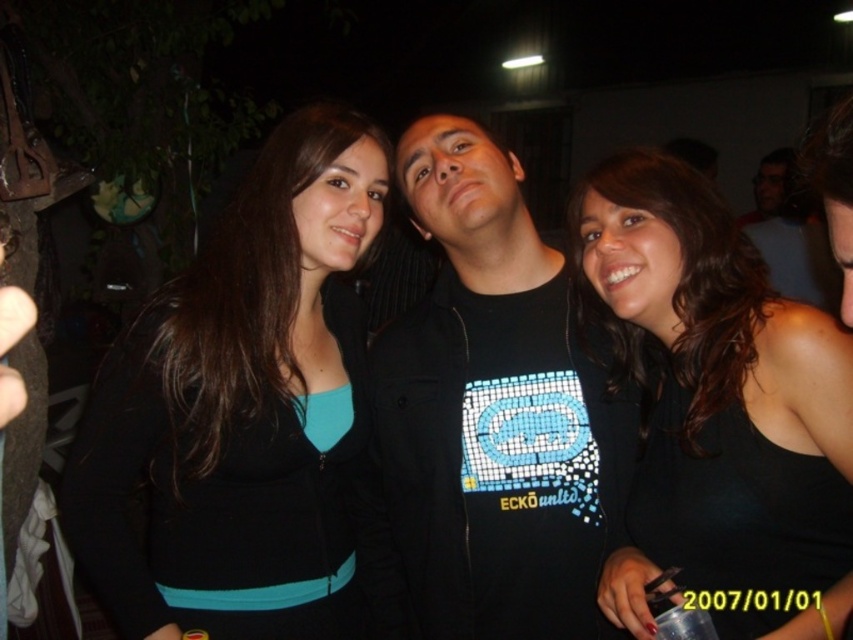
You are a photographer setting up for a group photo. You have two subjects wearing a black matte shirt at center and a black matte tank top at center. You need to ensure there is at least 10 inches of space between them for proper lighting. Based on the scene, is the current distance sufficient?

The black matte shirt at center is 8.29 inches from the black matte tank top at center, which is less than the required 10 inches. Therefore, the current distance is insufficient for proper lighting.